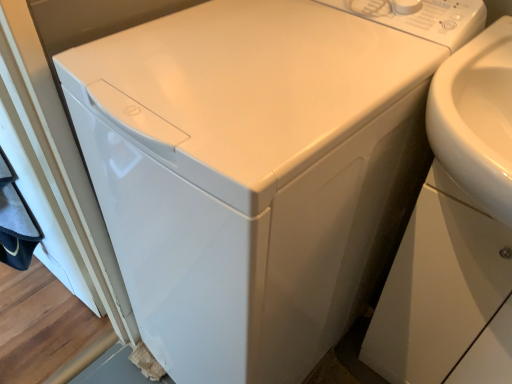
I want to click on white glossy drawer at lower right, so click(439, 286).

In order to face white glossy drawer at lower right, should I rotate leftwards or rightwards?

You should look right and rotate roughly 27.833 degrees.

This screenshot has height=384, width=512. Describe the element at coordinates (439, 286) in the screenshot. I see `white glossy drawer at lower right` at that location.

This screenshot has height=384, width=512. What are the coordinates of `white glossy drawer at lower right` in the screenshot? It's located at (439, 286).